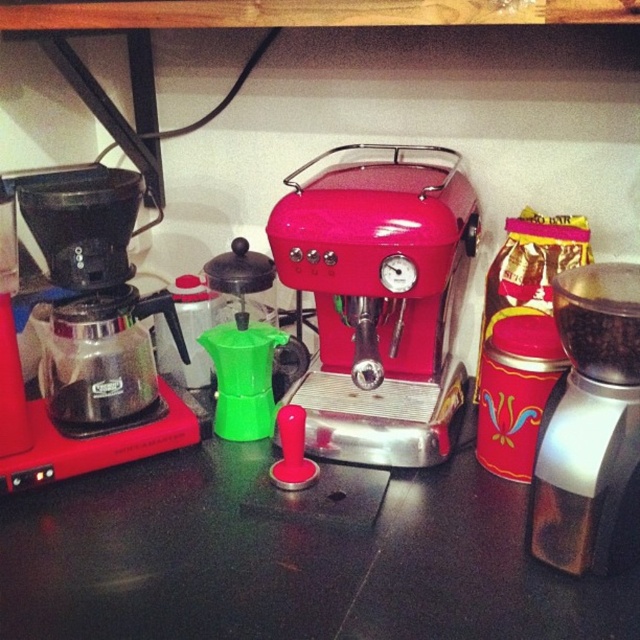
Is black matte counter top at center closer to the viewer compared to metallic silver grinder at center?

No, black matte counter top at center is behind metallic silver grinder at center.

Is point (70, 497) farther from viewer compared to point (564, 474)?

Yes.

Where is `black matte counter top at center`? The image size is (640, 640). black matte counter top at center is located at coordinates (288, 560).

Between black matte counter top at center and glossy metallic espresso machine at center, which one is positioned higher?

Positioned higher is glossy metallic espresso machine at center.

Locate an element on the screen. black matte counter top at center is located at coordinates (288, 560).

The image size is (640, 640). Find the location of `black matte counter top at center`. black matte counter top at center is located at coordinates (288, 560).

Does glossy metallic espresso machine at center appear on the right side of metallic silver grinder at center?

In fact, glossy metallic espresso machine at center is to the left of metallic silver grinder at center.

Is glossy metallic espresso machine at center taller than metallic silver grinder at center?

Yes.

The width and height of the screenshot is (640, 640). Find the location of `glossy metallic espresso machine at center`. glossy metallic espresso machine at center is located at coordinates (378, 301).